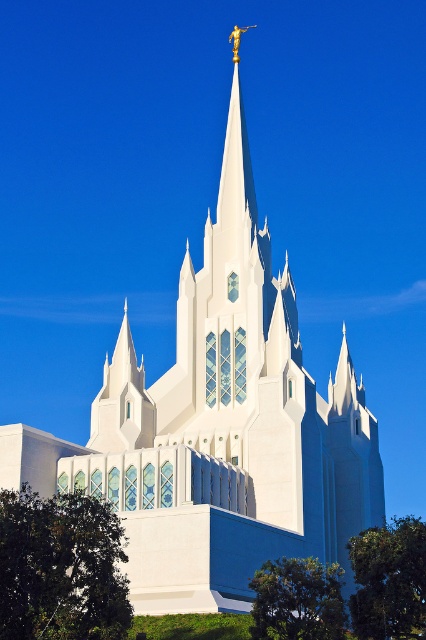
You are standing in front of the grand white temple with multiple pointed towers. You notice a point marked at coordinates (x=388, y=580). What object is located at this point?

The point at coordinates (x=388, y=580) indicates a green leafy tree at lower right.

You are standing in front of the temple and want to take a photo of the golden statue at the top of the spire. However, you notice two green leafy trees in the foreground. Which tree, the green leafy tree at lower right or the green leafy tree at lower center, is closer to you and might block your view?

The green leafy tree at lower right is in front of the green leafy tree at lower center, so it is closer to you and might block your view of the golden statue.

You are standing in front of the grand white temple with a prominent spire. You notice a point marked at coordinates point (60, 568). Based on the scene description, can you identify what object this point is located on?

The point (60, 568) is located on the green leafy tree at lower left.